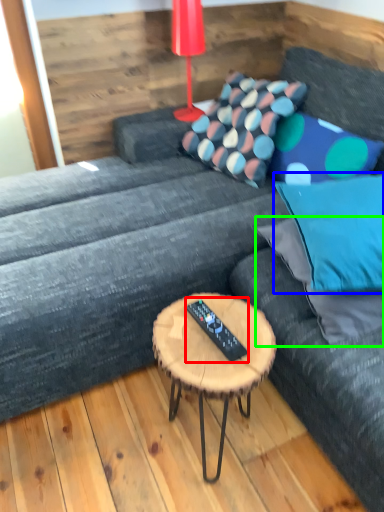
Question: Estimate the real-world distances between objects in this image. Which object is farther from remote (highlighted by a red box), pillow (highlighted by a blue box) or pillow (highlighted by a green box)?

Choices:
 (A) pillow
 (B) pillow

Answer: (A)